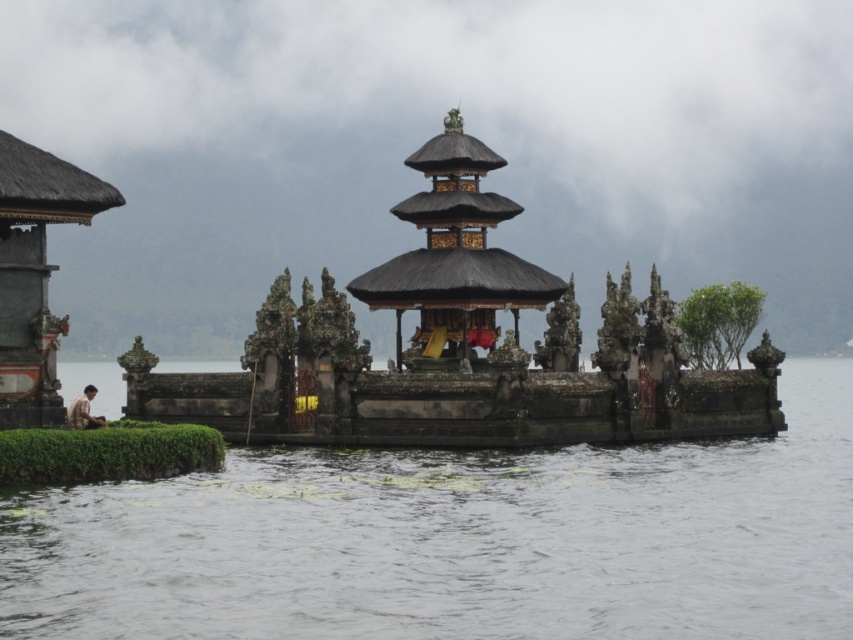
Question: Which object is closer to the camera taking this photo?

Choices:
 (A) dark brown wooden temple at center
 (B) brown fabric person at lower left

Answer: (B)

Question: Which point is closer to the camera?

Choices:
 (A) brown fabric person at lower left
 (B) dark brown wooden gazebo at center
 (C) clear water at lower center
 (D) dark brown wooden temple at center

Answer: (C)

Question: Does dark brown wooden temple at center appear under brown fabric person at lower left?

Choices:
 (A) no
 (B) yes

Answer: (A)

Question: Can you confirm if dark brown wooden temple at center is smaller than dark brown wooden gazebo at center?

Choices:
 (A) no
 (B) yes

Answer: (A)

Question: Is clear water at lower center below dark brown wooden gazebo at center?

Choices:
 (A) no
 (B) yes

Answer: (B)

Question: Which of the following is the farthest from the observer?

Choices:
 (A) (148, 522)
 (B) (531, 307)
 (C) (71, 406)
 (D) (18, 307)

Answer: (B)